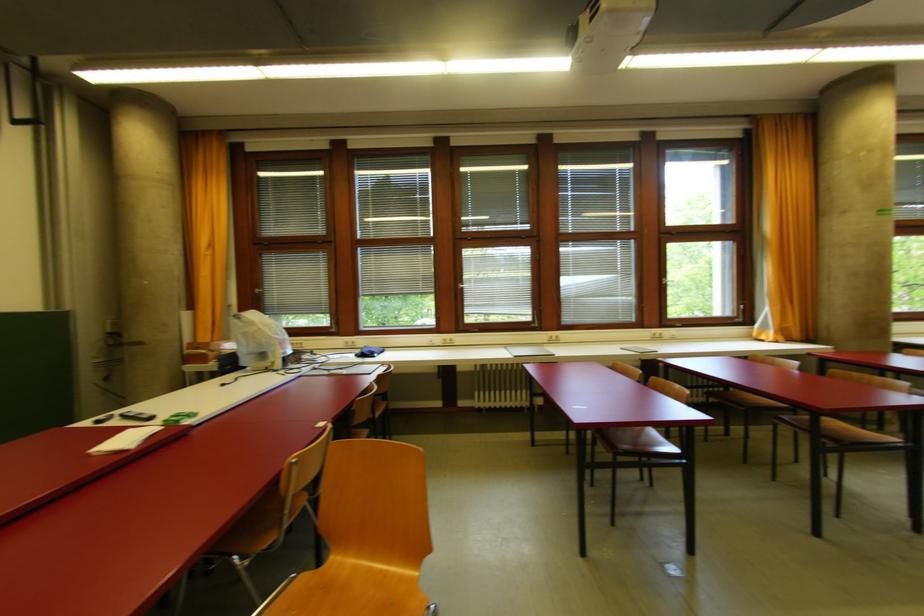
Which object does [137,416] point to?

It refers to a black smartphone.